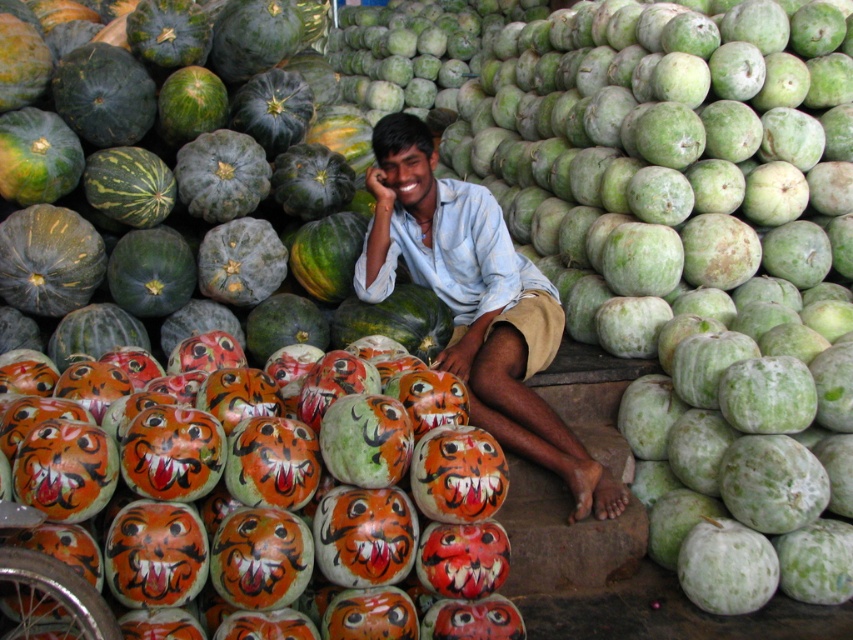
Which is above, painted orange pumpkin at center or light blue shirt at center?

light blue shirt at center is above.

Is painted orange pumpkin at center above light blue shirt at center?

Actually, painted orange pumpkin at center is below light blue shirt at center.

Between point (131, 632) and point (498, 252), which one is positioned in front?

Point (131, 632) is more forward.

You are a GUI agent. You are given a task and a screenshot of the screen. Output one action in this format:
    pyautogui.click(x=<x>, y=<y>)
    Task: Click on the painted orange pumpkin at center
    The width and height of the screenshot is (853, 640).
    Given the screenshot: What is the action you would take?
    pyautogui.click(x=273, y=516)